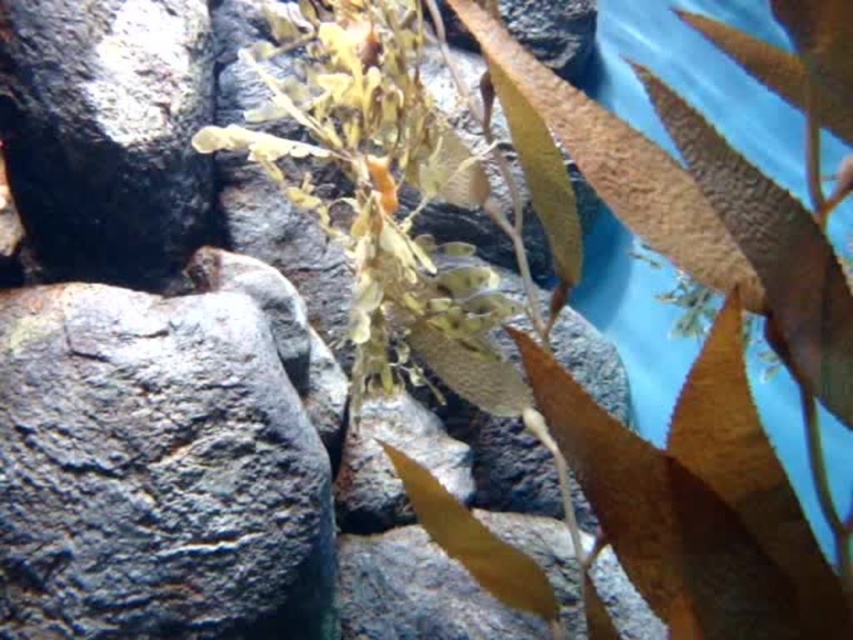
You are an underwater explorer who needs to place a small sensor on the largest rock in the scene. Which rock should you choose between the gray rough rock at left and the black matte rock at upper left?

The gray rough rock at left is larger in size than the black matte rock at upper left, so you should place the sensor on the gray rough rock at left.

You are a scuba diver who wants to place a small underwater camera on the gray rough rock at left. According to the coordinates provided, where exactly should you place the camera?

You should place the camera at point (157, 472) on the gray rough rock at left as specified in the coordinates.

You are an underwater explorer looking at the gray rough rock at left and the black matte rock at upper left. Which rock is closer to you?

The gray rough rock at left is closer to you because it is positioned in front of the black matte rock at upper left.